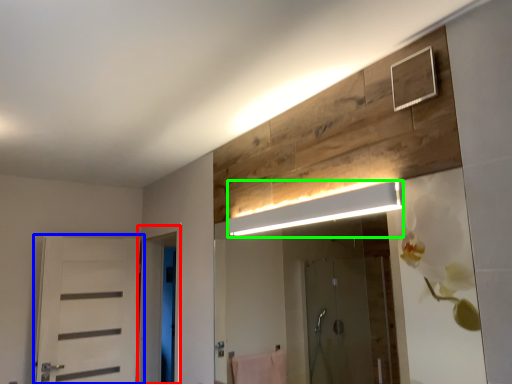
Question: Which object is positioned closest to screen door (highlighted by a red box)? Select from door (highlighted by a blue box) and light fixture (highlighted by a green box).

Choices:
 (A) door
 (B) light fixture

Answer: (A)